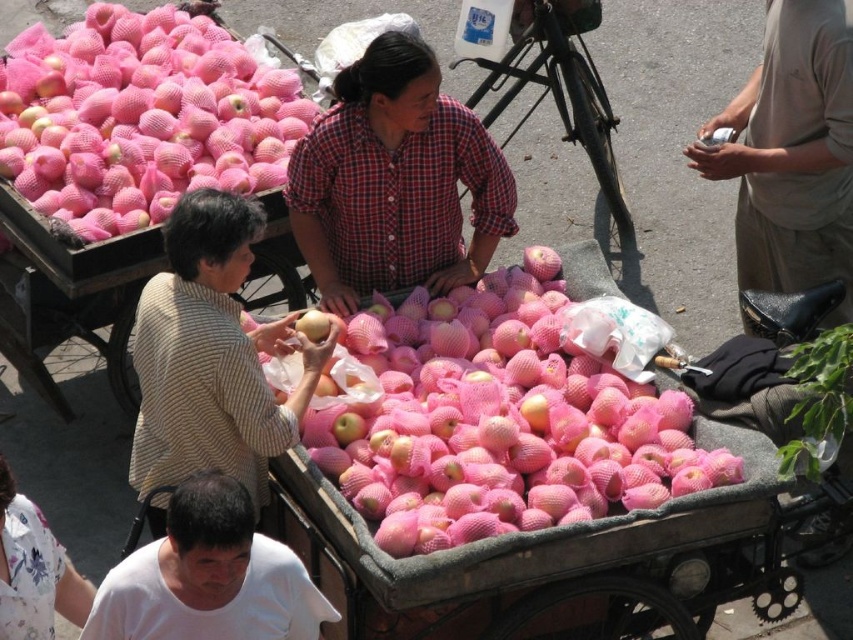
Question: Can you confirm if pink mesh bagged apples at center is positioned above pink mesh bagged apples at upper left?

Choices:
 (A) yes
 (B) no

Answer: (B)

Question: Which of the following is the farthest from the observer?

Choices:
 (A) white cotton shirt at lower left
 (B) pink mesh bagged apples at upper left

Answer: (B)

Question: Observing the image, what is the correct spatial positioning of red plaid shirt at center in reference to matte yellow apple at center?

Choices:
 (A) right
 (B) left

Answer: (A)

Question: Which object is closer to the camera taking this photo?

Choices:
 (A) pink mesh bagged apples at center
 (B) striped fabric shirt at center
 (C) red plaid shirt at center

Answer: (A)

Question: Can you confirm if pink mesh bagged apples at center is positioned to the left of white cotton shirt at lower left?

Choices:
 (A) no
 (B) yes

Answer: (A)

Question: Which is farther from the striped fabric shirt at center?

Choices:
 (A) pink mesh bagged apples at center
 (B) matte yellow apple at center
 (C) red plaid shirt at center

Answer: (C)